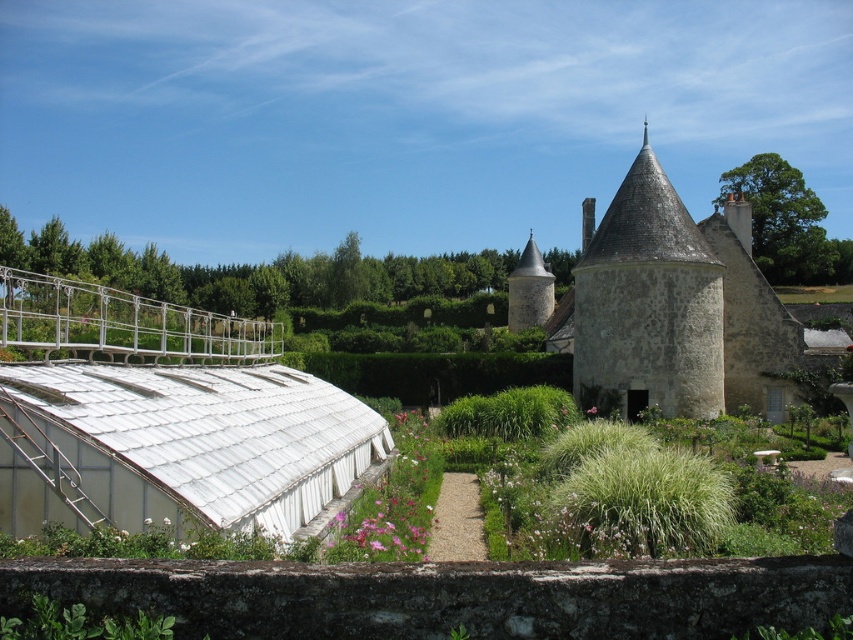
Which of these two, stone tower at center or green leafy plant at lower left, stands taller?

stone tower at center is taller.

You are a GUI agent. You are given a task and a screenshot of the screen. Output one action in this format:
    pyautogui.click(x=<x>, y=<y>)
    Task: Click on the stone tower at center
    
    Given the screenshot: What is the action you would take?
    pyautogui.click(x=668, y=307)

The image size is (853, 640). What do you see at coordinates (668, 307) in the screenshot? I see `stone tower at center` at bounding box center [668, 307].

In order to click on stone tower at center in this screenshot , I will do `click(668, 307)`.

Is stone tower at center behind stone textured tower at upper right?

Yes, stone tower at center is further from the viewer.

Is stone tower at center wider than stone textured tower at upper right?

Yes, stone tower at center is wider than stone textured tower at upper right.

What do you see at coordinates (668, 307) in the screenshot? The width and height of the screenshot is (853, 640). I see `stone tower at center` at bounding box center [668, 307].

This screenshot has height=640, width=853. Find the location of `stone tower at center`. stone tower at center is located at coordinates (668, 307).

Which is below, stone textured tower at upper right or green leafy plant at lower left?

green leafy plant at lower left is below.

Describe the element at coordinates (648, 301) in the screenshot. I see `stone textured tower at upper right` at that location.

Find the location of a particular element. stone textured tower at upper right is located at coordinates (648, 301).